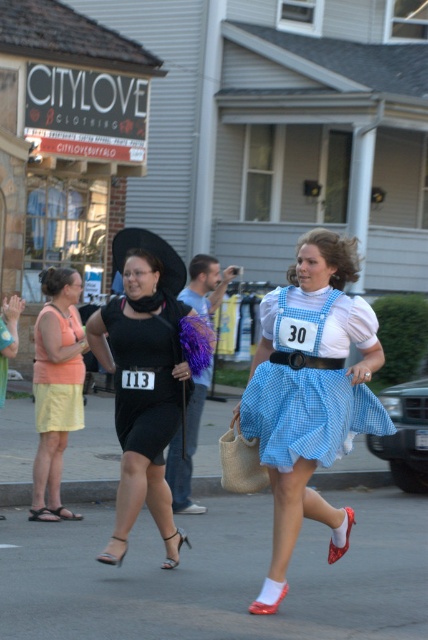
Question: Which point appears closest to the camera in this image?

Choices:
 (A) (53, 509)
 (B) (240, 410)
 (C) (323, 401)

Answer: (C)

Question: Does blue gingham skirt at center appear over black satin dress at center?

Choices:
 (A) no
 (B) yes

Answer: (A)

Question: Estimate the real-world distances between objects in this image. Which object is closer to the light yellow cotton skirt at lower left?

Choices:
 (A) black satin dress at center
 (B) matte black dress at center
 (C) blue gingham skirt at center

Answer: (B)

Question: Among these points, which one is nearest to the camera?

Choices:
 (A) (113, 298)
 (B) (275, 480)
 (C) (38, 358)
 (D) (2, 397)

Answer: (B)

Question: Does light yellow cotton skirt at lower left have a greater width compared to matte black dress at center?

Choices:
 (A) yes
 (B) no

Answer: (A)

Question: Can you confirm if blue gingham dress at center is thinner than light yellow cotton skirt at lower left?

Choices:
 (A) yes
 (B) no

Answer: (B)